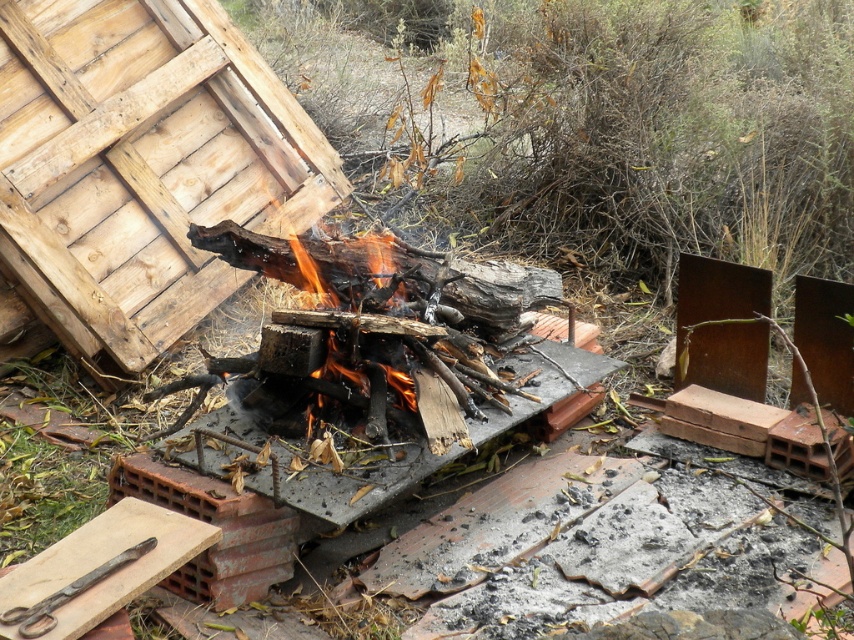
Question: Does weathered wood hut at upper left lie behind black metal scissors at lower left?

Choices:
 (A) yes
 (B) no

Answer: (A)

Question: Is weathered wood hut at upper left above black metal scissors at lower left?

Choices:
 (A) no
 (B) yes

Answer: (B)

Question: Is weathered wood hut at upper left thinner than black metal scissors at lower left?

Choices:
 (A) no
 (B) yes

Answer: (A)

Question: Which point is closer to the camera?

Choices:
 (A) weathered wood hut at upper left
 (B) black metal scissors at lower left

Answer: (B)

Question: Which object appears closest to the camera in this image?

Choices:
 (A) weathered wood hut at upper left
 (B) black metal scissors at lower left

Answer: (B)